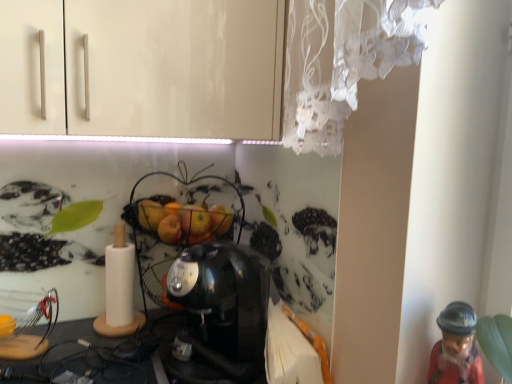
Question: From the image's perspective, does metallic wire basket at center appear lower than satin black coffee maker at center?

Choices:
 (A) no
 (B) yes

Answer: (A)

Question: Does metallic wire basket at center come behind satin black coffee maker at center?

Choices:
 (A) no
 (B) yes

Answer: (B)

Question: Can you confirm if metallic wire basket at center is positioned to the right of satin black coffee maker at center?

Choices:
 (A) no
 (B) yes

Answer: (A)

Question: Does metallic wire basket at center appear on the left side of satin black coffee maker at center?

Choices:
 (A) no
 (B) yes

Answer: (B)

Question: Is metallic wire basket at center looking in the opposite direction of satin black coffee maker at center?

Choices:
 (A) no
 (B) yes

Answer: (A)

Question: Is metallic wire basket at center completely or partially outside of satin black coffee maker at center?

Choices:
 (A) no
 (B) yes

Answer: (B)

Question: From the image's perspective, does satin black coffee maker at center appear higher than metallic wire basket at center?

Choices:
 (A) yes
 (B) no

Answer: (B)

Question: Is satin black coffee maker at center in front of metallic wire basket at center?

Choices:
 (A) yes
 (B) no

Answer: (A)

Question: Is the depth of satin black coffee maker at center greater than that of metallic wire basket at center?

Choices:
 (A) yes
 (B) no

Answer: (B)

Question: Considering the relative positions of satin black coffee maker at center and metallic wire basket at center in the image provided, is satin black coffee maker at center to the left of metallic wire basket at center from the viewer's perspective?

Choices:
 (A) no
 (B) yes

Answer: (A)

Question: Are satin black coffee maker at center and metallic wire basket at center making contact?

Choices:
 (A) no
 (B) yes

Answer: (B)

Question: Does satin black coffee maker at center have a smaller size compared to metallic wire basket at center?

Choices:
 (A) yes
 (B) no

Answer: (A)

Question: Is metallic wire basket at center completely or partially outside of red glossy figurine at lower right?

Choices:
 (A) yes
 (B) no

Answer: (A)